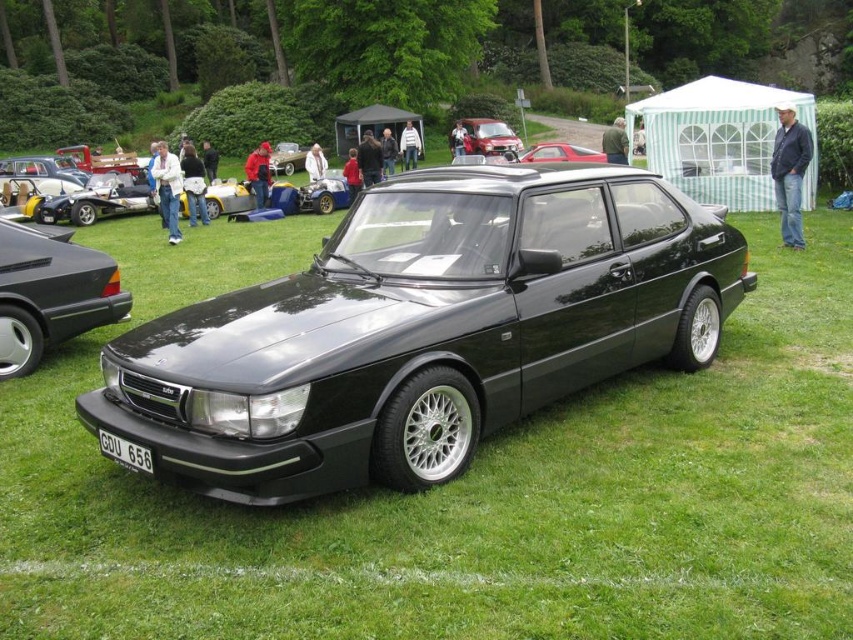
Does matte black sedan at center have a smaller size compared to matte black car at center?

Yes, matte black sedan at center is smaller than matte black car at center.

Can you confirm if matte black sedan at center is bigger than matte black car at center?

No.

Locate an element on the screen. Image resolution: width=853 pixels, height=640 pixels. matte black sedan at center is located at coordinates (50, 292).

Locate an element on the screen. Image resolution: width=853 pixels, height=640 pixels. matte black sedan at center is located at coordinates (50, 292).

Is matte black sedan at center taller than white plastic license plate at center?

Yes, matte black sedan at center is taller than white plastic license plate at center.

Is matte black sedan at center shorter than white plastic license plate at center?

In fact, matte black sedan at center may be taller than white plastic license plate at center.

Which is behind, point (56, 248) or point (144, 465)?

The point (56, 248) is more distant.

At what (x,y) coordinates should I click in order to perform the action: click on matte black sedan at center. Please return your answer as a coordinate pair (x, y). Looking at the image, I should click on (50, 292).

Is white plastic license plate at center positioned in front of matte black car at center?

Yes.

Which of these two, white plastic license plate at center or matte black car at center, stands taller?

matte black car at center is taller.

At what (x,y) coordinates should I click in order to perform the action: click on white plastic license plate at center. Please return your answer as a coordinate pair (x, y). The width and height of the screenshot is (853, 640). Looking at the image, I should click on (125, 451).